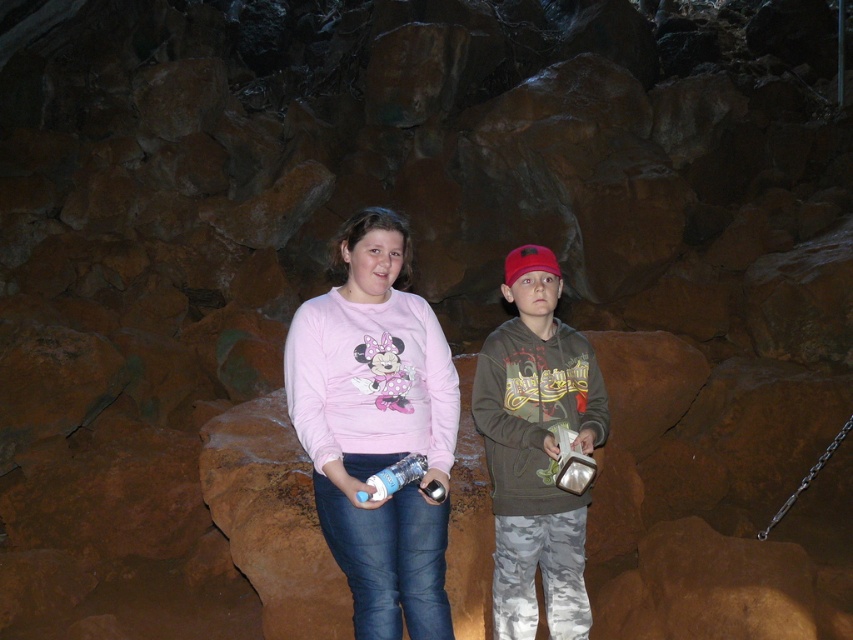
This screenshot has width=853, height=640. Find the location of `matte pink sweatshirt at center`. matte pink sweatshirt at center is located at coordinates (376, 428).

Which of these two, matte pink sweatshirt at center or camouflage pants at center, stands taller?

camouflage pants at center is taller.

Which is in front, point (363, 506) or point (514, 516)?

Point (363, 506) is more forward.

This screenshot has width=853, height=640. Identify the location of matte pink sweatshirt at center. (376, 428).